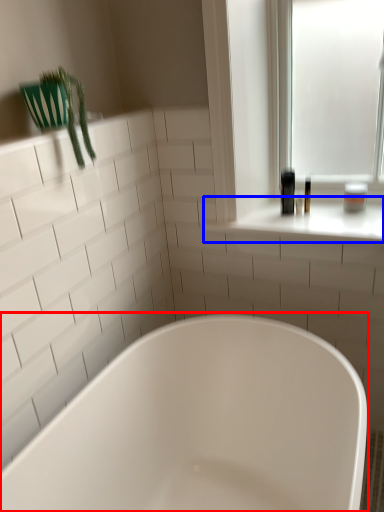
Question: Among these objects, which one is farthest to the camera, bathtub (highlighted by a red box) or window sill (highlighted by a blue box)?

Choices:
 (A) bathtub
 (B) window sill

Answer: (B)